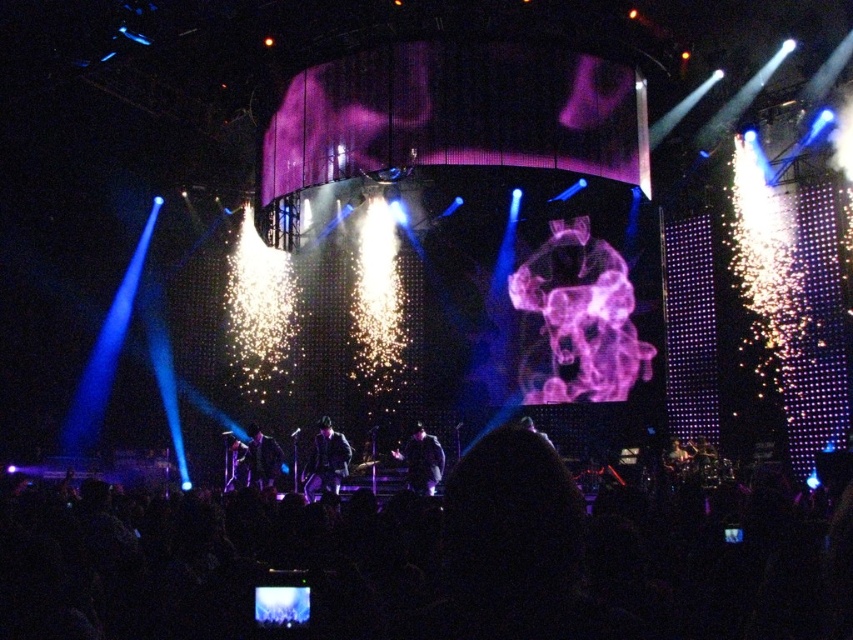
Between dark blue fabric jacket at center and dark suit at center, which one is positioned higher?

dark blue fabric jacket at center is above.

Locate an element on the screen. dark blue fabric jacket at center is located at coordinates (421, 460).

Can you confirm if shiny black suit at center is taller than dark suit at center?

Indeed, shiny black suit at center has a greater height compared to dark suit at center.

Between point (320, 419) and point (263, 448), which one is positioned behind?

Positioned behind is point (320, 419).

At what (x,y) coordinates should I click in order to perform the action: click on shiny black suit at center. Please return your answer as a coordinate pair (x, y). The image size is (853, 640). Looking at the image, I should click on 326,460.

From the picture: Is shiny black suit at center to the left of dark blue fabric jacket at center from the viewer's perspective?

Correct, you'll find shiny black suit at center to the left of dark blue fabric jacket at center.

Locate an element on the screen. This screenshot has height=640, width=853. shiny black suit at center is located at coordinates (326, 460).

Which is behind, point (328, 420) or point (436, 451)?

Point (328, 420)

Locate an element on the screen. The height and width of the screenshot is (640, 853). shiny black suit at center is located at coordinates (326, 460).